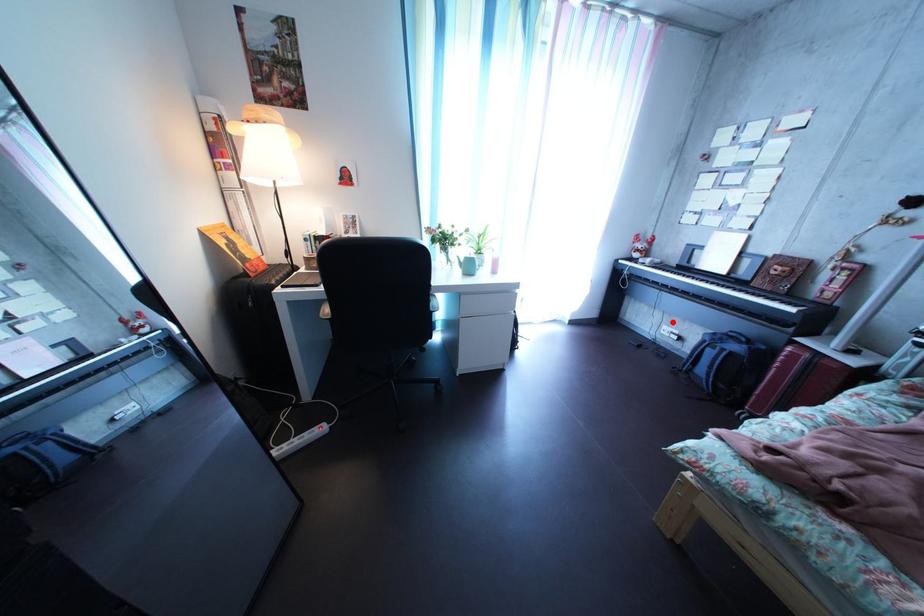
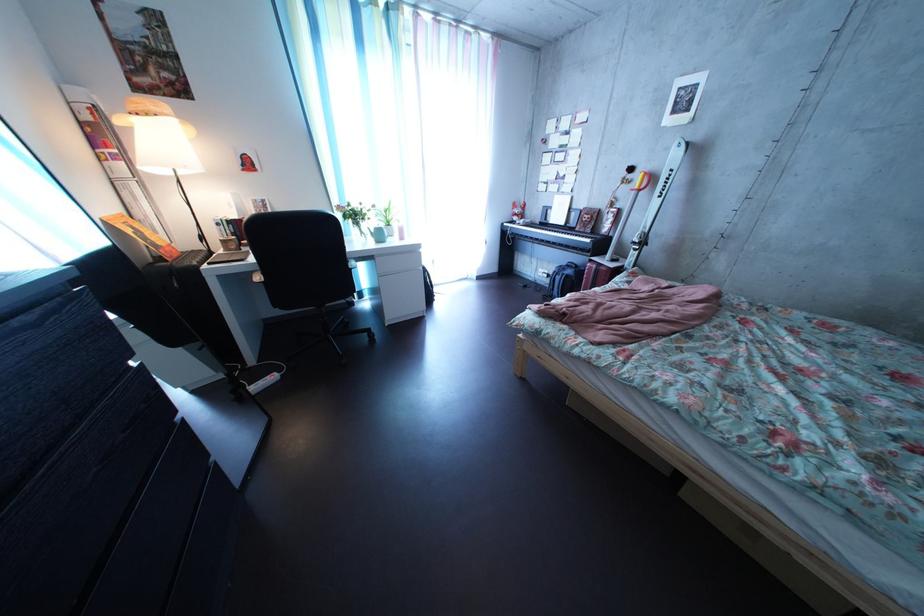
Where in the second image is the point corresponding to the highlighted location from the first image?

(550, 269)